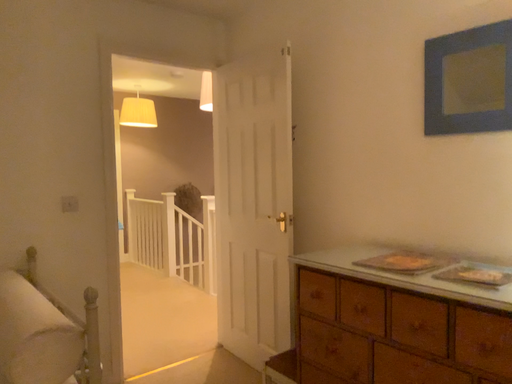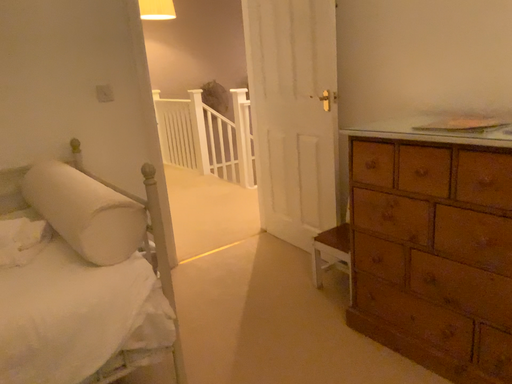
Question: Which way did the camera rotate in the video?

Choices:
 (A) rotated downward
 (B) rotated upward

Answer: (A)